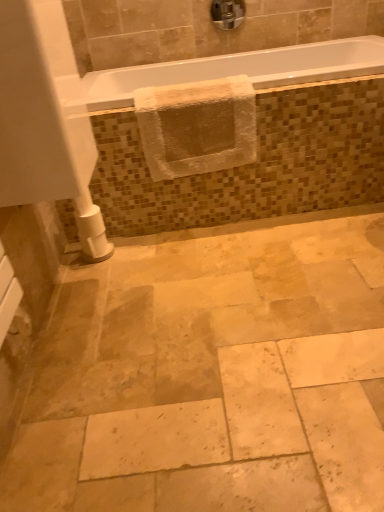
Question: Is white textured towel at upper center inside the boundaries of chrome metallic faucet at upper center, or outside?

Choices:
 (A) outside
 (B) inside

Answer: (A)

Question: Considering the positions of white textured towel at upper center and chrome metallic faucet at upper center in the image, is white textured towel at upper center wider or thinner than chrome metallic faucet at upper center?

Choices:
 (A) thin
 (B) wide

Answer: (B)

Question: Based on their relative distances, which object is nearer to the white glossy bathtub at upper center?

Choices:
 (A) chrome metallic faucet at upper center
 (B) white textured towel at upper center
 (C) natural stone tile at center

Answer: (B)

Question: Which is nearer to the chrome metallic faucet at upper center?

Choices:
 (A) natural stone tile at center
 (B) white glossy bathtub at upper center
 (C) white textured towel at upper center

Answer: (B)